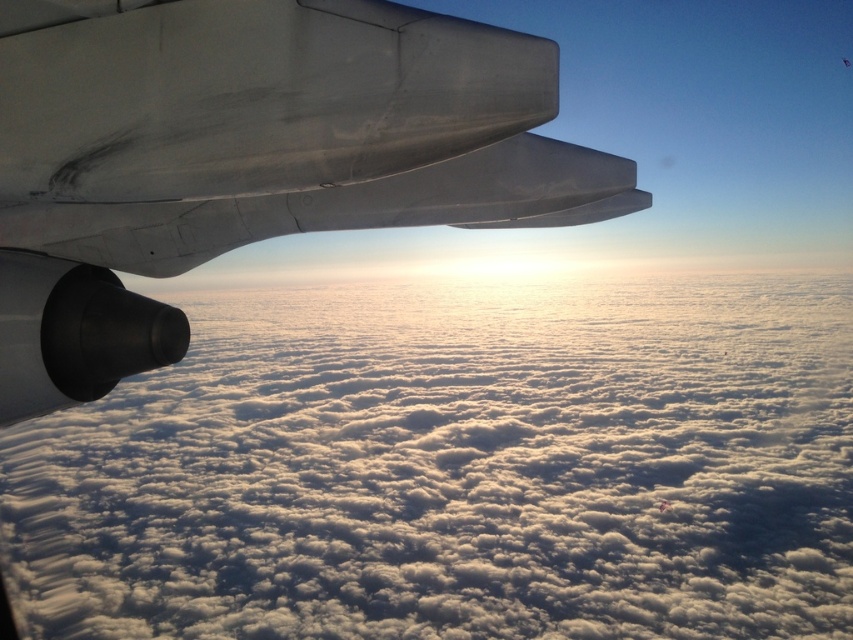
You are sitting by the window of an airplane and notice the white fluffy cloud at upper left and the metallic gray wing at upper left. Which object appears closer to you through the window?

The white fluffy cloud at upper left appears closer to you because it is positioned further to the viewer than the metallic gray wing at upper left.

You are a pilot looking at the clouds through the airplane window. There is a point marked at coordinates point (445, 484). What is located at that point?

The point (445, 484) marks a white fluffy cloud at upper left.

You are a passenger sitting by the window and looking out. You see the white fluffy cloud at upper left and the metallic gray wing at upper left. Which one is closer to the window?

The metallic gray wing at upper left is closer to the window because the white fluffy cloud at upper left is below it, meaning the wing is in front of the cloud from your viewpoint.